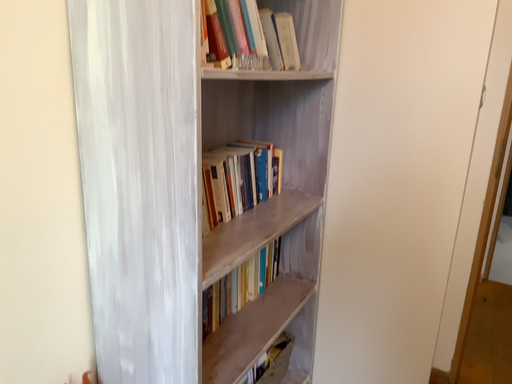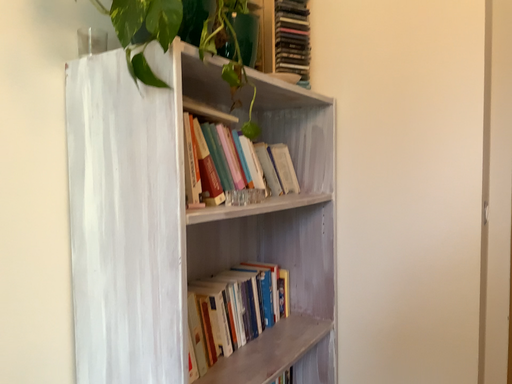
Question: Which way did the camera rotate in the video?

Choices:
 (A) rotated upward
 (B) rotated downward

Answer: (A)